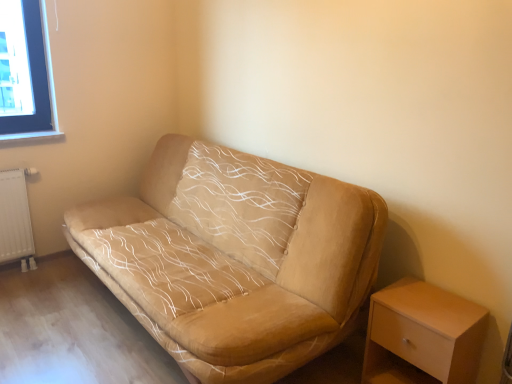
Find the location of a particular element. The width and height of the screenshot is (512, 384). free region under white textured radiator at lower left (from a real-world perspective) is located at coordinates (29, 268).